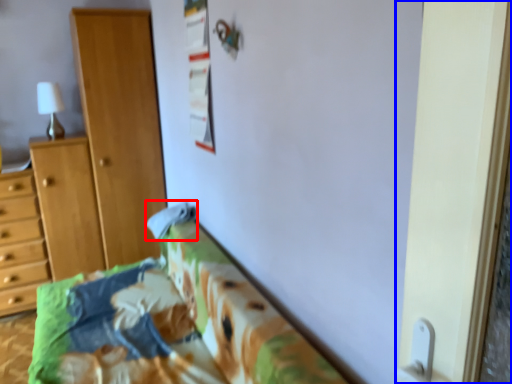
Question: Which object is further to the camera taking this photo, pillow (highlighted by a red box) or screen door (highlighted by a blue box)?

Choices:
 (A) pillow
 (B) screen door

Answer: (A)